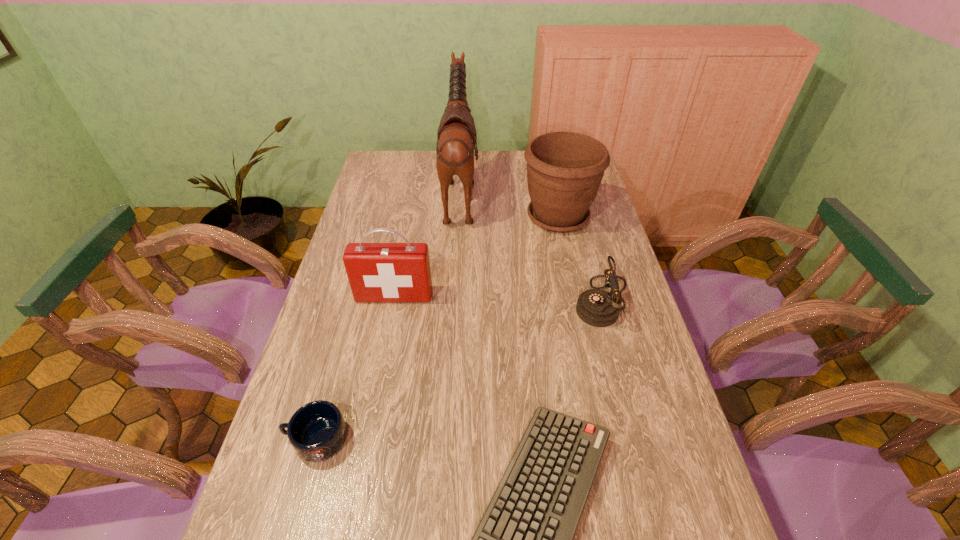
I want to click on the first-aid kit situated at the left edge, so click(x=377, y=272).

Find the location of `mug present at the left edge`. mug present at the left edge is located at coordinates (317, 430).

Where is `flowerpot positioned at the right edge`? The width and height of the screenshot is (960, 540). flowerpot positioned at the right edge is located at coordinates (564, 169).

Identify the location of telephone that is at the right edge. Image resolution: width=960 pixels, height=540 pixels. (596, 307).

I want to click on vacant space at the far edge of the desktop, so click(x=517, y=167).

The width and height of the screenshot is (960, 540). Identify the location of free space at the left edge of the desktop. [334, 328].

Identify the location of vacant space at the right edge of the desktop. [x=636, y=299].

This screenshot has height=540, width=960. In the image, there is a desktop. Find the location of `free space at the far left corner`. free space at the far left corner is located at coordinates (396, 165).

In order to click on vacant space that's between the telephone and the tallest object in this screenshot , I will do `click(532, 247)`.

You are a GUI agent. You are given a task and a screenshot of the screen. Output one action in this format:
    pyautogui.click(x=<x>, y=<y>)
    Task: Click on the free area in between the saddle and the fourth tallest object
    This screenshot has height=540, width=960.
    Given the screenshot: What is the action you would take?
    pyautogui.click(x=532, y=247)